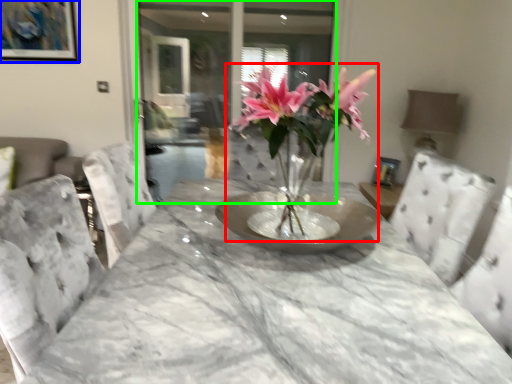
Question: Considering the real-world distances, which object is closest to houseplant (highlighted by a red box)? picture frame (highlighted by a blue box) or glass door (highlighted by a green box).

Choices:
 (A) picture frame
 (B) glass door

Answer: (A)